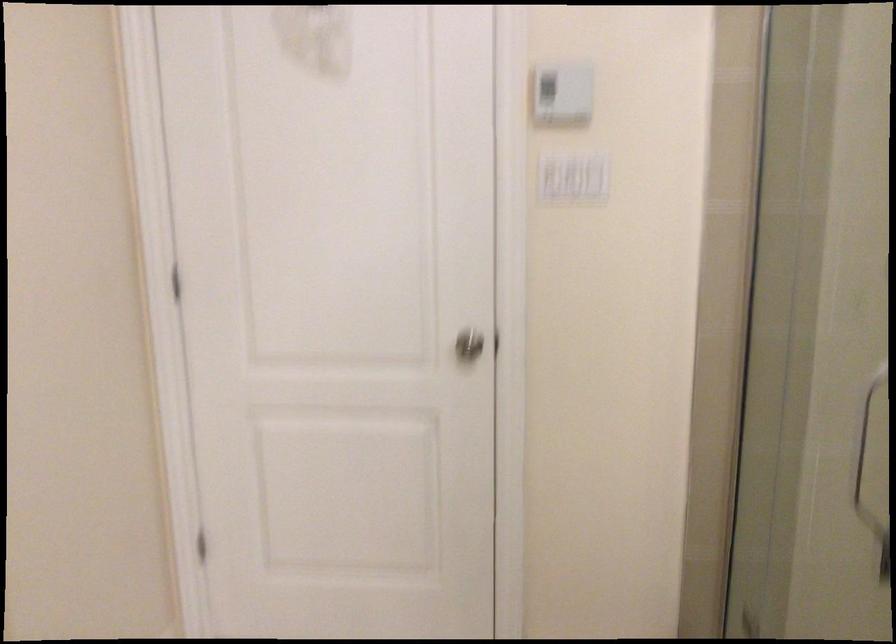
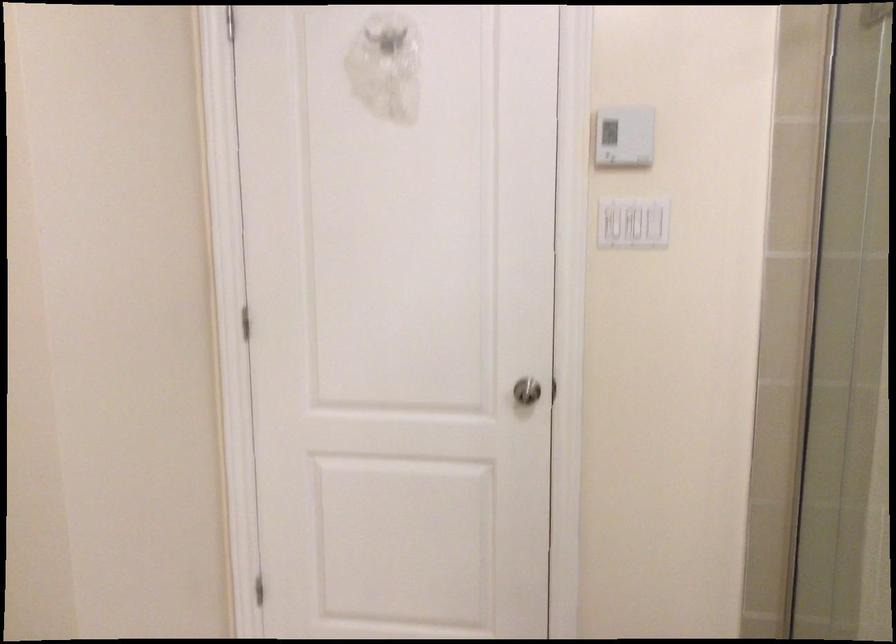
Where in the second image is the point corresponding to point 549,129 from the first image?

(608, 222)